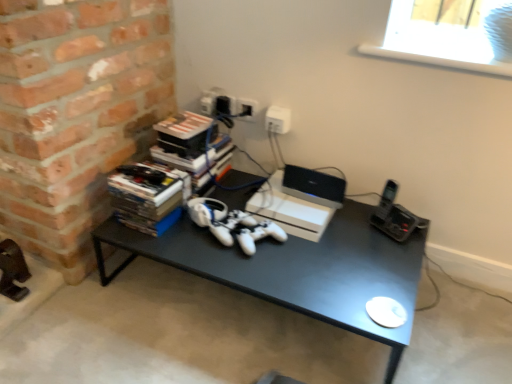
Question: From a real-world perspective, is white plastic window screen at upper right on white matte gaming console at center?

Choices:
 (A) yes
 (B) no

Answer: (A)

Question: Does white plastic window screen at upper right have a larger size compared to white matte gaming console at center?

Choices:
 (A) no
 (B) yes

Answer: (B)

Question: Is white plastic window screen at upper right surrounding white matte gaming console at center?

Choices:
 (A) no
 (B) yes

Answer: (A)

Question: Is white plastic window screen at upper right aimed at white matte gaming console at center?

Choices:
 (A) yes
 (B) no

Answer: (B)

Question: From the image's perspective, is white plastic window screen at upper right located above white matte gaming console at center?

Choices:
 (A) yes
 (B) no

Answer: (A)

Question: Is black matte desk at center taller or shorter than white plastic electric outlet at upper center?

Choices:
 (A) short
 (B) tall

Answer: (B)

Question: Considering the positions of black matte desk at center and white plastic electric outlet at upper center in the image, is black matte desk at center wider or thinner than white plastic electric outlet at upper center?

Choices:
 (A) wide
 (B) thin

Answer: (A)

Question: Looking at the image, does black matte desk at center seem bigger or smaller compared to white plastic electric outlet at upper center?

Choices:
 (A) big
 (B) small

Answer: (A)

Question: Would you say black matte desk at center is to the left or to the right of white plastic electric outlet at upper center in the picture?

Choices:
 (A) right
 (B) left

Answer: (B)

Question: From the image's perspective, is white plastic window screen at upper right positioned above or below white plastic laptop at center?

Choices:
 (A) above
 (B) below

Answer: (A)

Question: From a real-world perspective, is white plastic window screen at upper right physically located above or below white plastic laptop at center?

Choices:
 (A) below
 (B) above

Answer: (B)

Question: Considering the positions of white plastic window screen at upper right and white plastic laptop at center in the image, is white plastic window screen at upper right bigger or smaller than white plastic laptop at center?

Choices:
 (A) big
 (B) small

Answer: (A)

Question: In the image, is white plastic window screen at upper right on the left side or the right side of white plastic laptop at center?

Choices:
 (A) right
 (B) left

Answer: (A)

Question: In the image, is white plastic electric outlet at upper center positioned in front of or behind white plastic window screen at upper right?

Choices:
 (A) behind
 (B) front

Answer: (A)

Question: From a real-world perspective, is white plastic electric outlet at upper center physically located above or below white plastic window screen at upper right?

Choices:
 (A) below
 (B) above

Answer: (A)